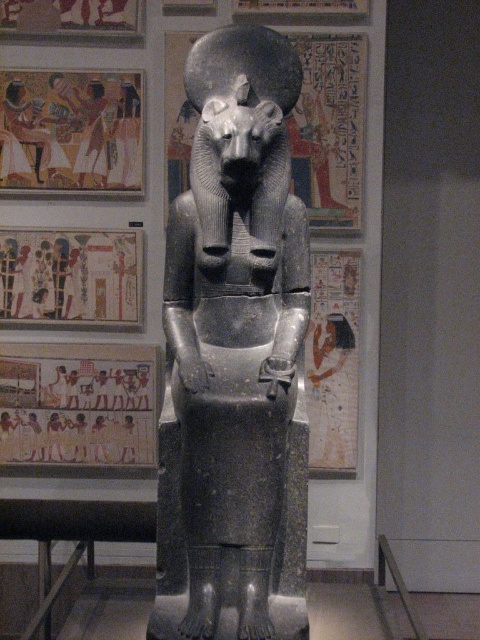
Who is more forward, (58, 161) or (84, 317)?

Point (58, 161) is in front.

Is earthy clay figures at upper left further to the viewer compared to matte stone mural at left?

No, it is in front of matte stone mural at left.

Find the location of a particular element. The height and width of the screenshot is (640, 480). earthy clay figures at upper left is located at coordinates (71, 131).

The width and height of the screenshot is (480, 640). What are the coordinates of `earthy clay figures at upper left` in the screenshot? It's located at (71, 131).

How far apart are black stone statue at center and earthy clay figures at upper left?

They are 4.65 feet apart.

Is black stone statue at center closer to camera compared to earthy clay figures at upper left?

Yes, it is.

Is point (263, 490) closer to viewer compared to point (45, 168)?

Yes, point (263, 490) is closer to viewer.

The width and height of the screenshot is (480, 640). Find the location of `black stone statue at center`. black stone statue at center is located at coordinates (235, 356).

Who is more forward, (188, 358) or (82, 413)?

Point (188, 358) is in front.

What do you see at coordinates (235, 356) in the screenshot? I see `black stone statue at center` at bounding box center [235, 356].

Is point (156, 589) positioned before point (103, 419)?

Yes, it is.

Find the location of a particular element. The height and width of the screenshot is (640, 480). black stone statue at center is located at coordinates (235, 356).